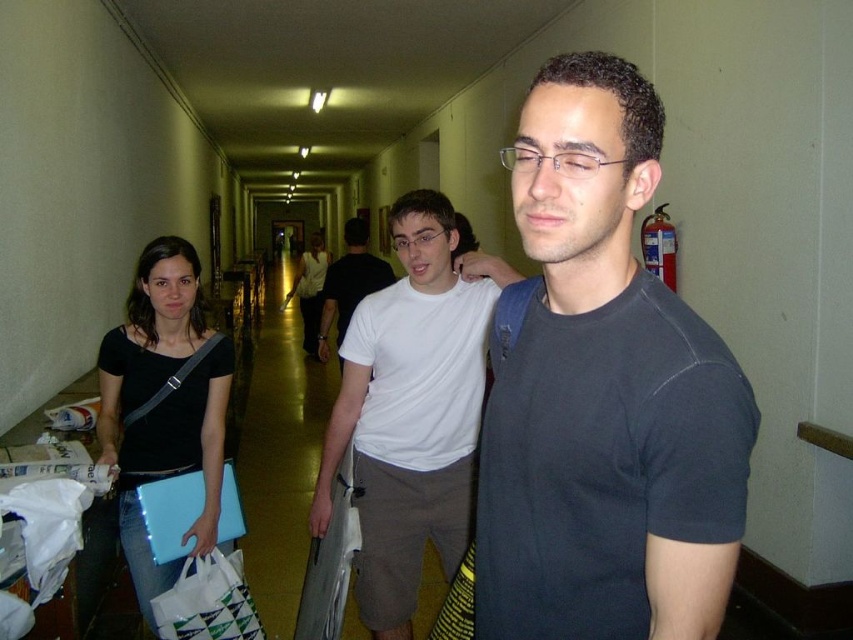
You are standing in the hallway and want to move from point A to point B. Point A is at coordinate point(519, 497) and point B is at coordinate point(148, 250). Which point is closer to you?

Point A is closer to you than point B because the description states that point(519, 497) is closer to the viewer than point(148, 250).